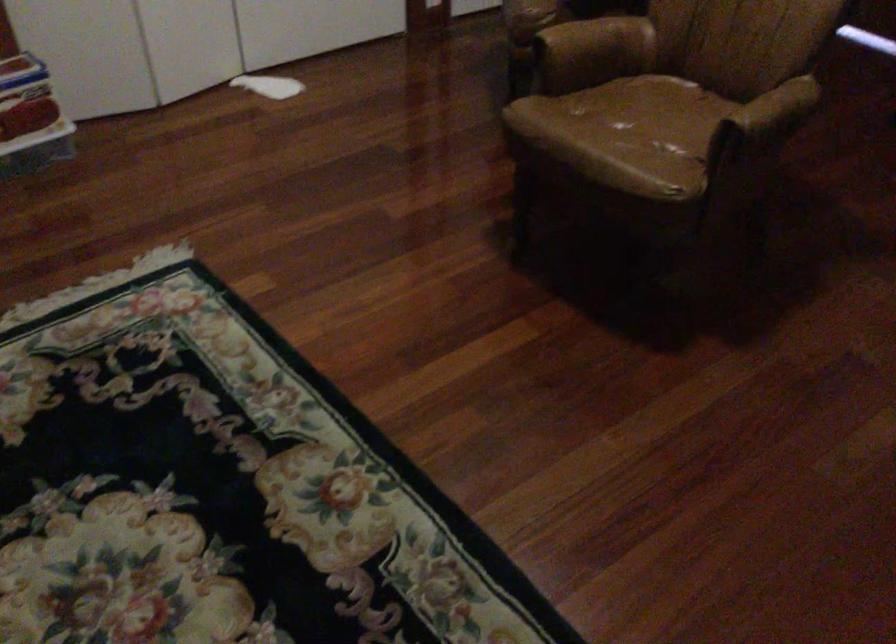
Where would you rest the brown chair armrest? Please return your answer as a coordinate pair (x, y).

(776, 109)